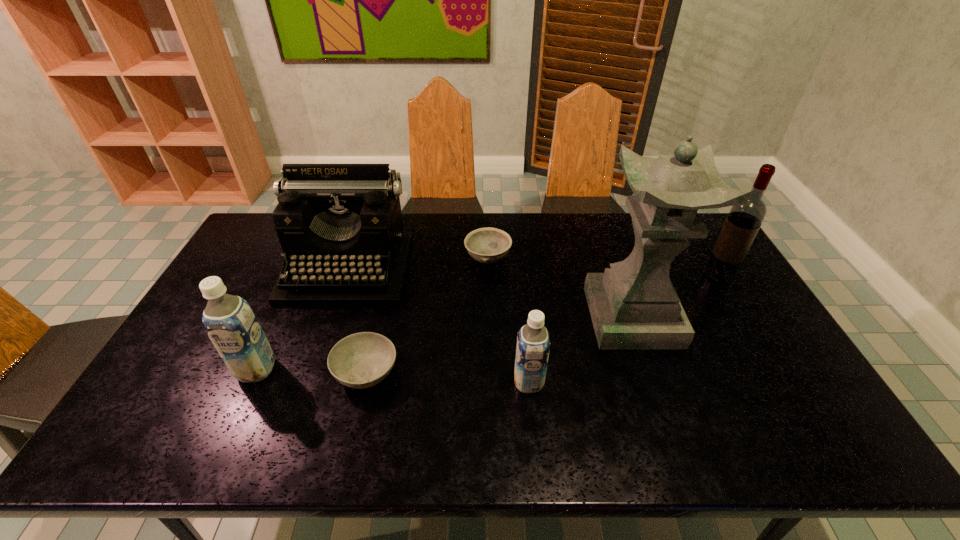
Where is `the shorter bowl`? the shorter bowl is located at coordinates (361, 360).

The height and width of the screenshot is (540, 960). I want to click on vacant area situated 0.060m on the label of the left soya milk, so click(240, 405).

Locate an element on the screen. This screenshot has height=540, width=960. vacant space located 0.400m on the label of the shorter soya milk is located at coordinates (359, 382).

Identify the location of vacant space situated on the label of the shorter soya milk. (363, 382).

You are a GUI agent. You are given a task and a screenshot of the screen. Output one action in this format:
    pyautogui.click(x=<x>, y=<y>)
    Task: Click on the vacant space located on the label of the shorter soya milk
    This screenshot has width=960, height=540.
    Given the screenshot: What is the action you would take?
    pyautogui.click(x=494, y=382)

The height and width of the screenshot is (540, 960). Identify the location of vacant area located 0.090m on the left of the farther bowl. (438, 259).

This screenshot has width=960, height=540. Find the location of `free spot located 0.360m at the front opening of the sculpture`. free spot located 0.360m at the front opening of the sculpture is located at coordinates (x=468, y=317).

Where is `free spot located at the front opening of the sculpture`? free spot located at the front opening of the sculpture is located at coordinates (519, 317).

You are a GUI agent. You are given a task and a screenshot of the screen. Output one action in this format:
    pyautogui.click(x=<x>, y=<y>)
    Task: Click on the free space located at the front opening of the sculpture
    The image size is (960, 540).
    Given the screenshot: What is the action you would take?
    pyautogui.click(x=526, y=317)

Locate an element on the screen. free space located 0.050m on the front of the wine bottle is located at coordinates (731, 296).